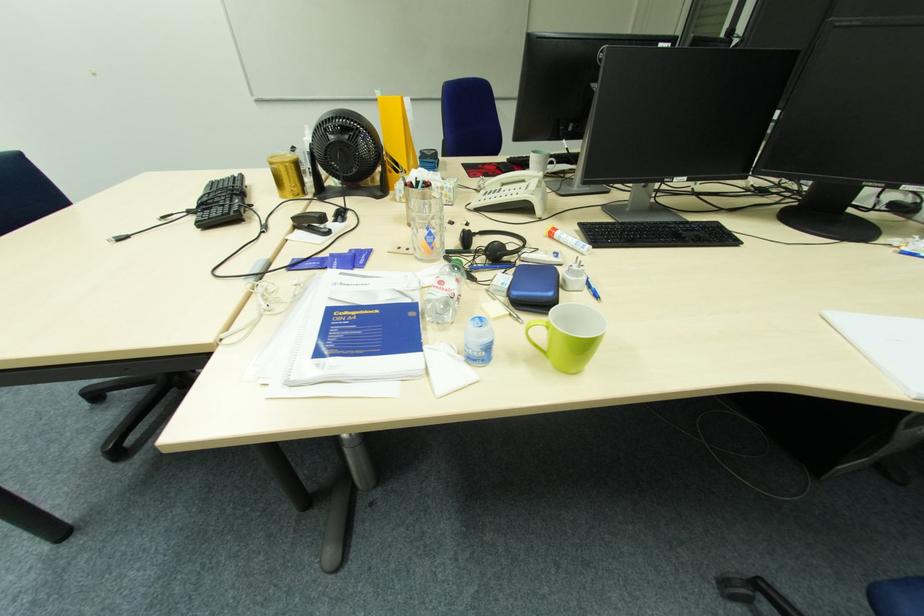
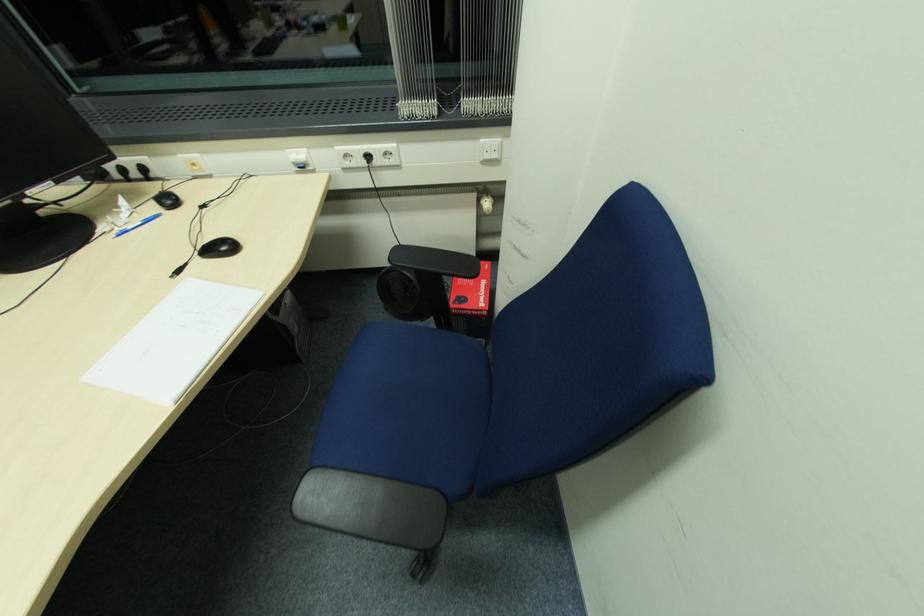
The first image is from the beginning of the video and the second image is from the end. How did the camera likely rotate when shooting the video?

The camera rotated toward right-down.